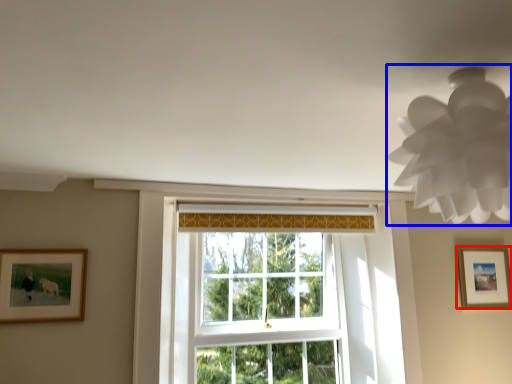
Question: Which of the following is the closest to the observer, picture frame (highlighted by a red box) or lamp (highlighted by a blue box)?

Choices:
 (A) picture frame
 (B) lamp

Answer: (B)